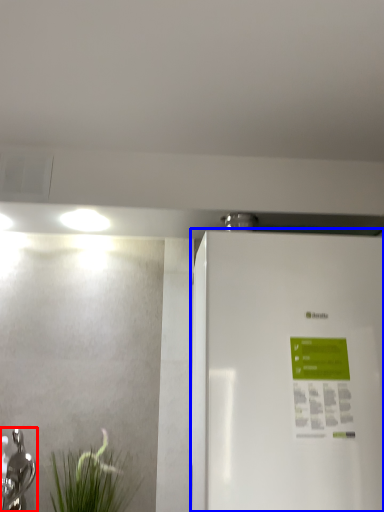
Question: Which object is closer to the camera taking this photo, tap (highlighted by a red box) or refrigerator (highlighted by a blue box)?

Choices:
 (A) tap
 (B) refrigerator

Answer: (B)